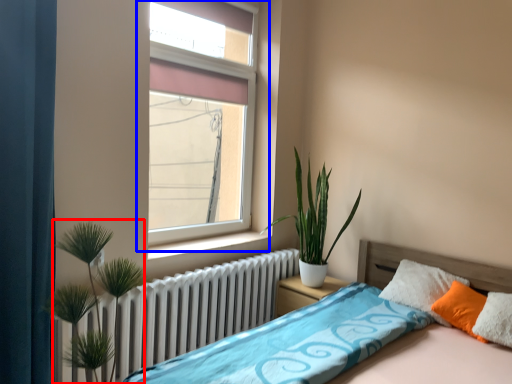
Question: Which object appears closest to the camera in this image, vegetation (highlighted by a red box) or window (highlighted by a blue box)?

Choices:
 (A) vegetation
 (B) window

Answer: (A)